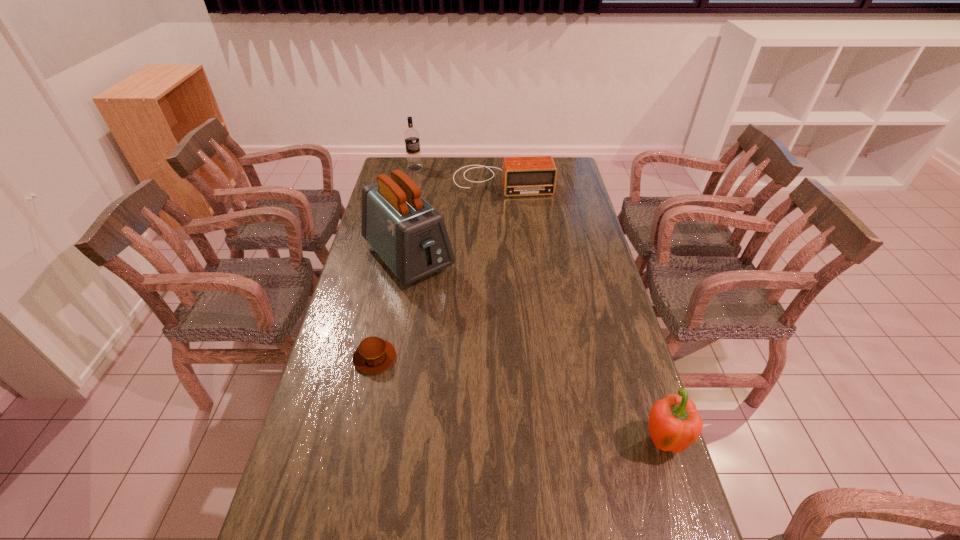
Find the location of a particular element. The image size is (960, 540). radio receiver present at the far edge is located at coordinates (521, 176).

Where is `muffin positioned at the left edge`? The height and width of the screenshot is (540, 960). muffin positioned at the left edge is located at coordinates (374, 355).

Find the location of a particular element. vodka that is at the left edge is located at coordinates (411, 136).

I want to click on toaster situated at the left edge, so click(410, 236).

Identify the location of pepper located in the right edge section of the desktop. (674, 424).

Locate an element on the screen. The width and height of the screenshot is (960, 540). radio receiver that is at the right edge is located at coordinates (521, 176).

The height and width of the screenshot is (540, 960). Identify the location of object located in the far left corner section of the desktop. (411, 136).

Identify the location of object at the far right corner. This screenshot has width=960, height=540. (521, 176).

The width and height of the screenshot is (960, 540). In order to click on vacant area at the far edge of the desktop in this screenshot , I will do `click(471, 172)`.

In the image, there is a desktop. At what (x,y) coordinates should I click in order to perform the action: click on vacant space at the near edge. Please return your answer as a coordinate pair (x, y). The width and height of the screenshot is (960, 540). Looking at the image, I should click on (566, 510).